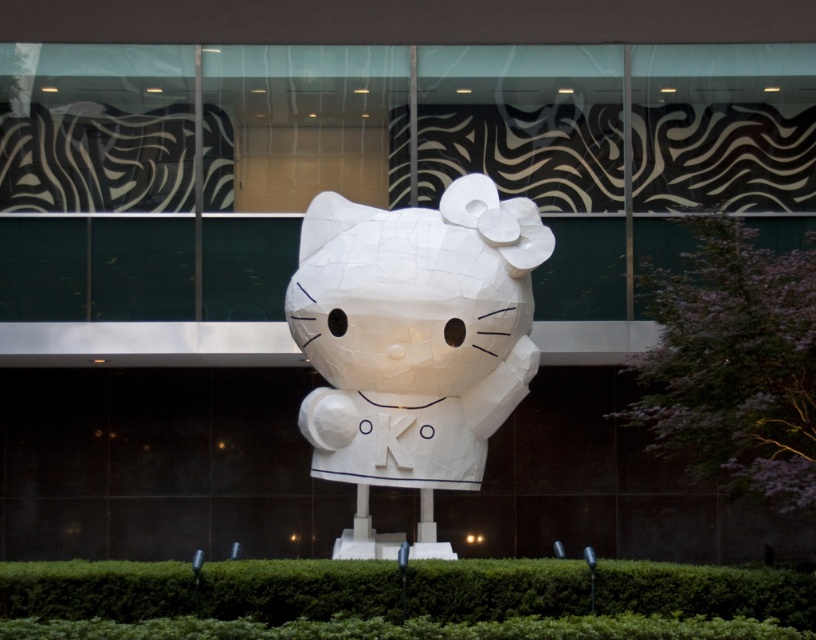
Question: Among these points, which one is farthest from the camera?

Choices:
 (A) (781, 506)
 (B) (73, 566)
 (C) (477, 243)

Answer: (A)

Question: Which point is closer to the camera?

Choices:
 (A) (739, 253)
 (B) (94, 596)
 (C) (477, 273)

Answer: (B)

Question: Which point is closer to the camera?

Choices:
 (A) green leafy hedge at right
 (B) green leafy hedge at center

Answer: (B)

Question: Is white paper sculpture at center positioned behind green leafy hedge at center?

Choices:
 (A) yes
 (B) no

Answer: (A)

Question: Where is white paper sculpture at center located in relation to green leafy hedge at right in the image?

Choices:
 (A) above
 (B) below

Answer: (A)

Question: Does green leafy hedge at center appear over green leafy hedge at right?

Choices:
 (A) no
 (B) yes

Answer: (A)